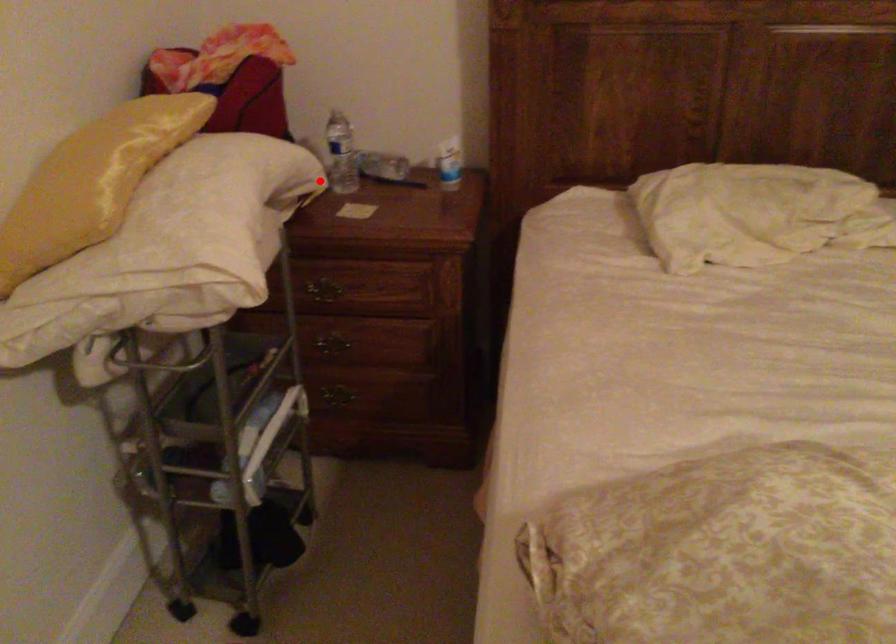
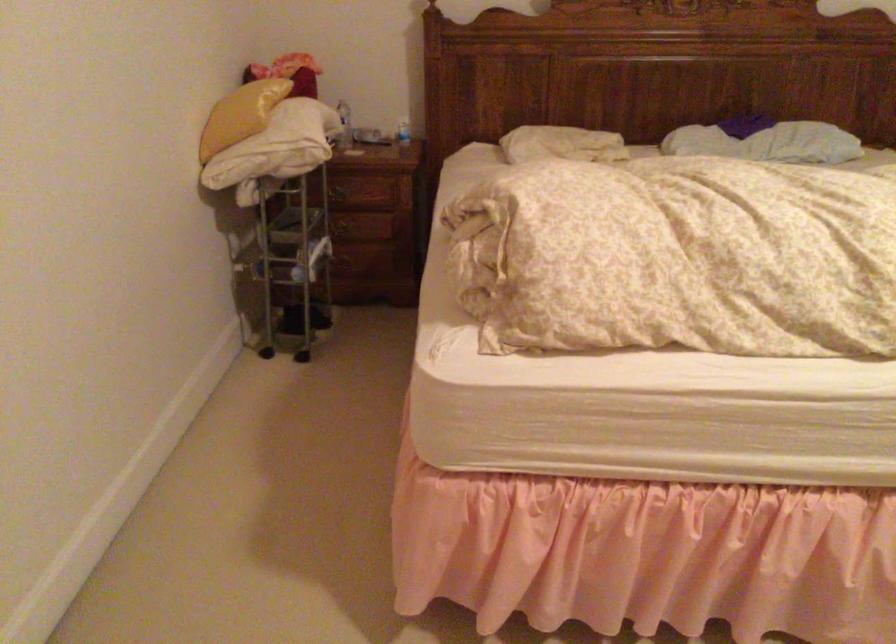
Question: I am providing you with two images of the same scene from different viewpoints. Given a red point in image1, look at the same physical point in image2. Is it:

Choices:
 (A) Closer to the viewpoint
 (B) Farther from the viewpoint

Answer: (B)